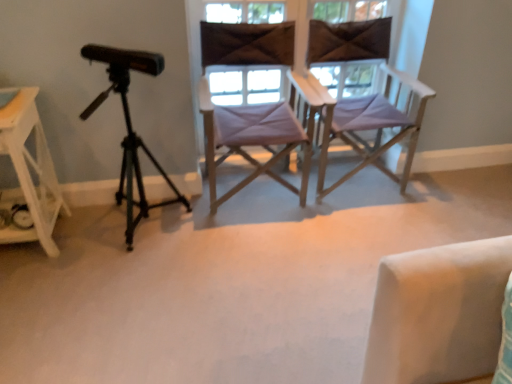
The image size is (512, 384). Identify the location of vacant space underneath black matte tripod at left (from a real-world perspective). [158, 232].